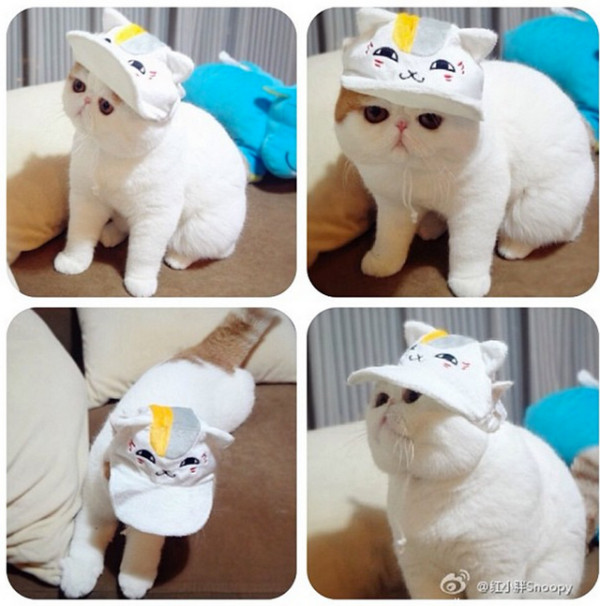
At what (x,y) coordinates should I click in order to perform the action: click on blue pillow. Please return your answer as a coordinate pair (x, y). Looking at the image, I should click on (574, 67), (246, 85), (559, 436).